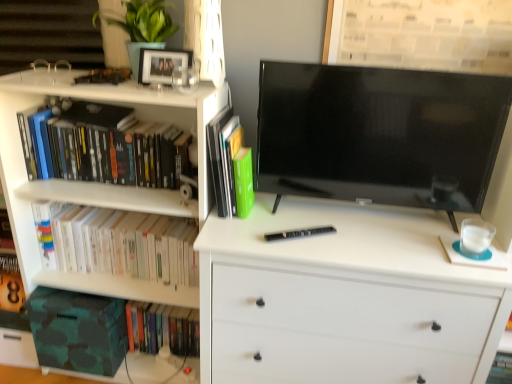
Question: Is black glossy tv at center touching white matte chest of drawers at center?

Choices:
 (A) yes
 (B) no

Answer: (B)

Question: Is black glossy tv at center surrounding white matte chest of drawers at center?

Choices:
 (A) yes
 (B) no

Answer: (B)

Question: Is black glossy tv at center facing away from white matte chest of drawers at center?

Choices:
 (A) no
 (B) yes

Answer: (A)

Question: Is black glossy tv at center bigger than white matte chest of drawers at center?

Choices:
 (A) yes
 (B) no

Answer: (B)

Question: Is black glossy tv at center positioned far away from white matte chest of drawers at center?

Choices:
 (A) yes
 (B) no

Answer: (B)

Question: Is black glossy tv at center positioned before white matte chest of drawers at center?

Choices:
 (A) yes
 (B) no

Answer: (B)

Question: From the image's perspective, is hardcover book at lower left, marked as the 4th book in a top-to-bottom arrangement, above camouflage fabric storage box at lower left?

Choices:
 (A) no
 (B) yes

Answer: (A)

Question: Can you see hardcover book at lower left, marked as the 4th book in a top-to-bottom arrangement, touching camouflage fabric storage box at lower left?

Choices:
 (A) yes
 (B) no

Answer: (B)

Question: Is hardcover book at lower left, marked as the 4th book in a top-to-bottom arrangement, aimed at camouflage fabric storage box at lower left?

Choices:
 (A) no
 (B) yes

Answer: (A)

Question: Is hardcover book at lower left, marked as the 4th book in a top-to-bottom arrangement, looking in the opposite direction of camouflage fabric storage box at lower left?

Choices:
 (A) yes
 (B) no

Answer: (B)

Question: Is there a large distance between hardcover book at lower left, marked as the 4th book in a top-to-bottom arrangement, and camouflage fabric storage box at lower left?

Choices:
 (A) yes
 (B) no

Answer: (B)

Question: Is camouflage fabric storage box at lower left a part of hardcover book at lower left, marked as the 4th book in a top-to-bottom arrangement?

Choices:
 (A) no
 (B) yes

Answer: (A)

Question: Could you tell me if black matte pen at center is facing green matte book at center, which is the third book from bottom to top?

Choices:
 (A) yes
 (B) no

Answer: (B)